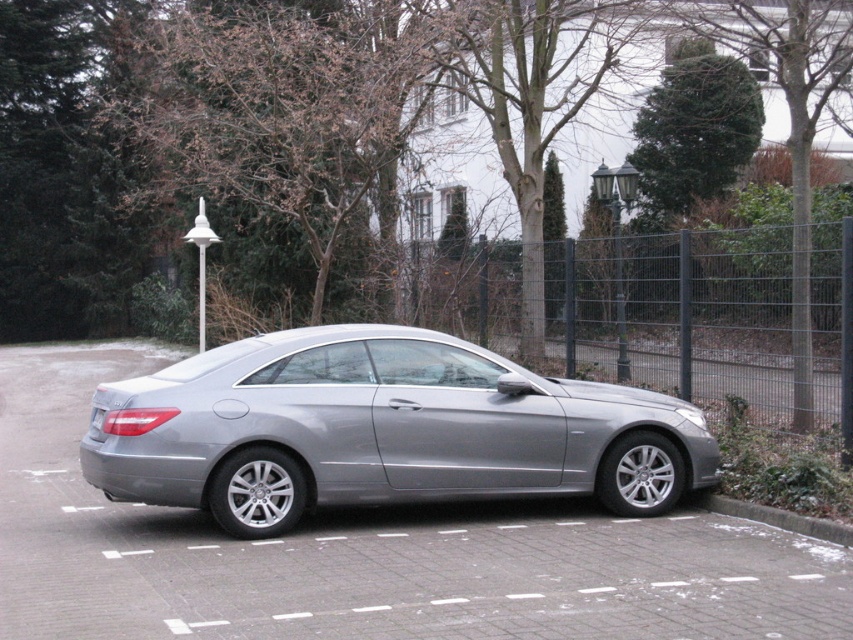
You are a delivery person trying to park your van in the driveway. You see the satin silver car at center and the green textured bush at upper right. Which object is closer to the left side of the driveway?

The satin silver car at center is positioned on the left side of the green textured bush at upper right, meaning it is closer to the left side of the driveway.

You are standing in front of a silver Mercedes car parked on a driveway. There is a point marked at coordinates (693, 132). Based on the scene, what object is this point located on?

The point is located on a green textured bush at upper right.